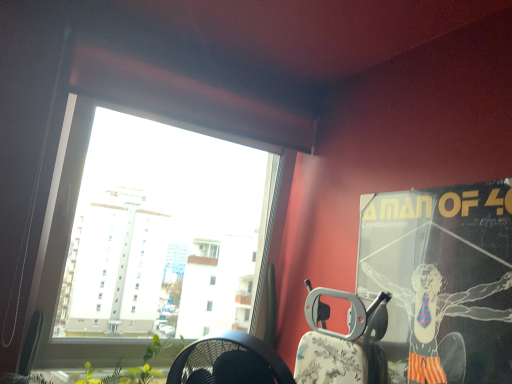
The width and height of the screenshot is (512, 384). What do you see at coordinates (343, 342) in the screenshot?
I see `metallic silver armchair at right` at bounding box center [343, 342].

What are the coordinates of `metallic silver armchair at right` in the screenshot? It's located at (343, 342).

The width and height of the screenshot is (512, 384). Describe the element at coordinates (443, 280) in the screenshot. I see `matte black poster at upper right` at that location.

Identify the location of matte black poster at upper right. The height and width of the screenshot is (384, 512). (443, 280).

Image resolution: width=512 pixels, height=384 pixels. Find the location of `metallic silver armchair at right`. metallic silver armchair at right is located at coordinates (343, 342).

Does metallic silver armchair at right appear on the left side of matte black poster at upper right?

Indeed, metallic silver armchair at right is positioned on the left side of matte black poster at upper right.

Considering the positions of objects metallic silver armchair at right and matte black poster at upper right in the image provided, who is behind, metallic silver armchair at right or matte black poster at upper right?

metallic silver armchair at right is more distant.

Does point (352, 317) come closer to viewer compared to point (386, 230)?

No, (352, 317) is further to viewer.

From the image's perspective, is metallic silver armchair at right located beneath matte black poster at upper right?

Yes, from the image's perspective, metallic silver armchair at right is below matte black poster at upper right.

From a real-world perspective, is metallic silver armchair at right on top of matte black poster at upper right?

No, from a real-world perspective, metallic silver armchair at right is not on top of matte black poster at upper right.

Consider the image. Which of these two, metallic silver armchair at right or matte black poster at upper right, is thinner?

Thinner between the two is matte black poster at upper right.

Considering the relative sizes of metallic silver armchair at right and matte black poster at upper right in the image provided, is metallic silver armchair at right shorter than matte black poster at upper right?

Yes, metallic silver armchair at right is shorter than matte black poster at upper right.

Who is bigger, metallic silver armchair at right or matte black poster at upper right?

Bigger between the two is matte black poster at upper right.

Would you say metallic silver armchair at right is outside matte black poster at upper right?

Absolutely, metallic silver armchair at right is external to matte black poster at upper right.

Is the surface of metallic silver armchair at right in direct contact with matte black poster at upper right?

No, metallic silver armchair at right is not next to matte black poster at upper right.

Is metallic silver armchair at right oriented away from matte black poster at upper right?

metallic silver armchair at right does not have its back to matte black poster at upper right.

The height and width of the screenshot is (384, 512). I want to click on poster page on the right of metallic silver armchair at right, so click(443, 280).

Which is more to the right, matte black poster at upper right or metallic silver armchair at right?

matte black poster at upper right.

Is matte black poster at upper right positioned behind metallic silver armchair at right?

No, it is not.

Considering the points (503, 262) and (383, 294), which point is in front, point (503, 262) or point (383, 294)?

Point (503, 262)

From the image's perspective, which object appears higher, matte black poster at upper right or metallic silver armchair at right?

matte black poster at upper right, from the image's perspective.

From a real-world perspective, who is located lower, matte black poster at upper right or metallic silver armchair at right?

In real-world perspective, metallic silver armchair at right is lower.

Based on the photo, which object is thinner, matte black poster at upper right or metallic silver armchair at right?

Thinner between the two is matte black poster at upper right.

Can you confirm if matte black poster at upper right is shorter than metallic silver armchair at right?

No, matte black poster at upper right is not shorter than metallic silver armchair at right.

Who is bigger, matte black poster at upper right or metallic silver armchair at right?

matte black poster at upper right.

Is matte black poster at upper right positioned beyond the bounds of metallic silver armchair at right?

matte black poster at upper right lies outside metallic silver armchair at right's area.

Can you see matte black poster at upper right touching metallic silver armchair at right?

matte black poster at upper right and metallic silver armchair at right are clearly separated.

Could you tell me if matte black poster at upper right is facing metallic silver armchair at right?

No, matte black poster at upper right is not aimed at metallic silver armchair at right.

How distant is matte black poster at upper right from metallic silver armchair at right?

matte black poster at upper right is 9.38 inches away from metallic silver armchair at right.

In order to click on armchair below the matte black poster at upper right (from a real-world perspective) in this screenshot , I will do `click(343, 342)`.

Identify the location of armchair beneath the matte black poster at upper right (from a real-world perspective). Image resolution: width=512 pixels, height=384 pixels. (343, 342).

What are the coordinates of `armchair below the matte black poster at upper right (from the image's perspective)` in the screenshot? It's located at (343, 342).